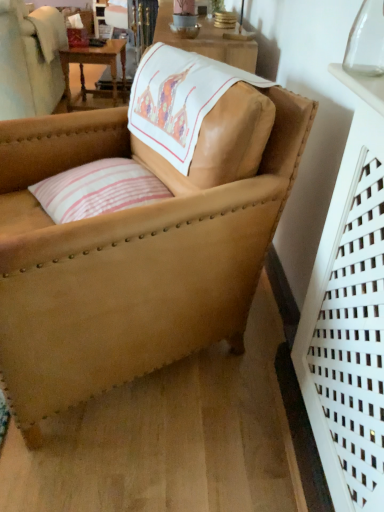
Question: Does pink striped fabric pillow at center have a greater width compared to leather armchair at center?

Choices:
 (A) no
 (B) yes

Answer: (A)

Question: Is pink striped fabric pillow at center facing away from leather armchair at center?

Choices:
 (A) yes
 (B) no

Answer: (A)

Question: From a real-world perspective, is pink striped fabric pillow at center over leather armchair at center?

Choices:
 (A) no
 (B) yes

Answer: (B)

Question: Is pink striped fabric pillow at center not inside leather armchair at center?

Choices:
 (A) yes
 (B) no

Answer: (B)

Question: From a real-world perspective, is pink striped fabric pillow at center located beneath leather armchair at center?

Choices:
 (A) yes
 (B) no

Answer: (B)

Question: Could leather armchair at center be considered to be inside pink striped fabric pillow at center?

Choices:
 (A) no
 (B) yes

Answer: (A)

Question: From a real-world perspective, is leather armchair at center below pink striped fabric pillow at center?

Choices:
 (A) yes
 (B) no

Answer: (A)

Question: Is leather armchair at center oriented away from pink striped fabric pillow at center?

Choices:
 (A) yes
 (B) no

Answer: (A)

Question: From a real-world perspective, is leather armchair at center physically above pink striped fabric pillow at center?

Choices:
 (A) yes
 (B) no

Answer: (B)

Question: Can you confirm if leather armchair at center is smaller than pink striped fabric pillow at center?

Choices:
 (A) no
 (B) yes

Answer: (A)

Question: Is leather armchair at center far from pink striped fabric pillow at center?

Choices:
 (A) no
 (B) yes

Answer: (A)

Question: Can you confirm if leather armchair at center is bigger than pink striped fabric pillow at center?

Choices:
 (A) no
 (B) yes

Answer: (B)

Question: Could you tell me if transparent glass vase at upper right is facing wooden table at upper left?

Choices:
 (A) no
 (B) yes

Answer: (A)